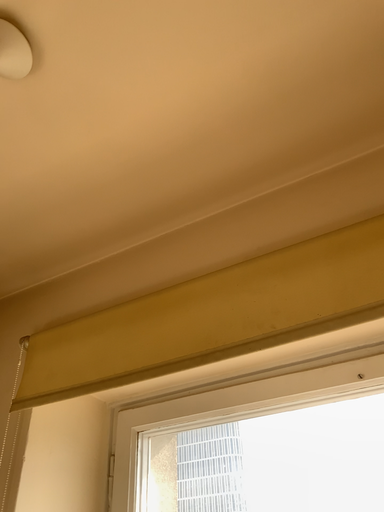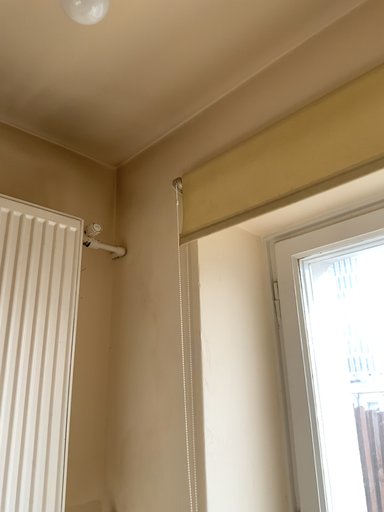
Question: Which way did the camera rotate in the video?

Choices:
 (A) rotated upward
 (B) rotated downward

Answer: (B)